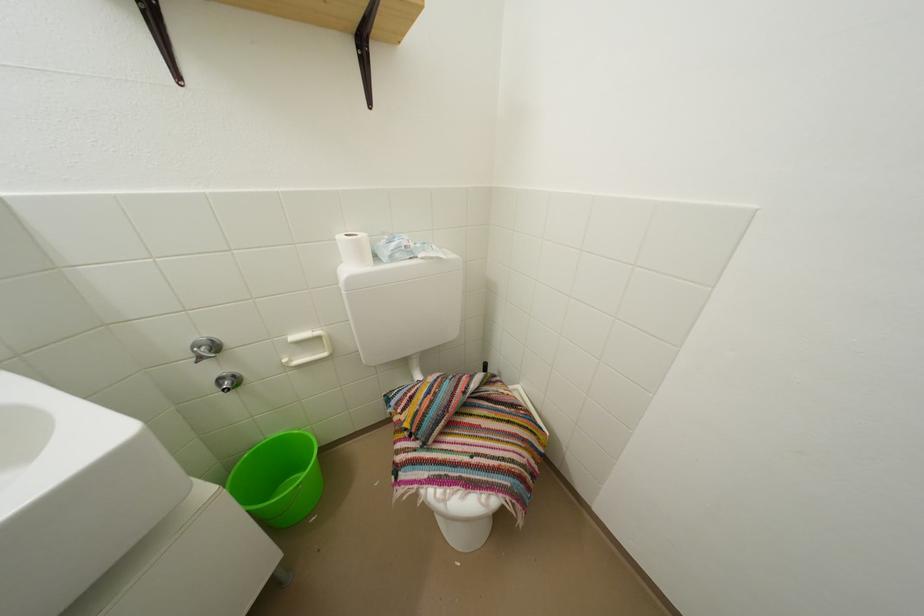
The location [278,479] corresponds to which object?

It refers to a green plastic bucket.